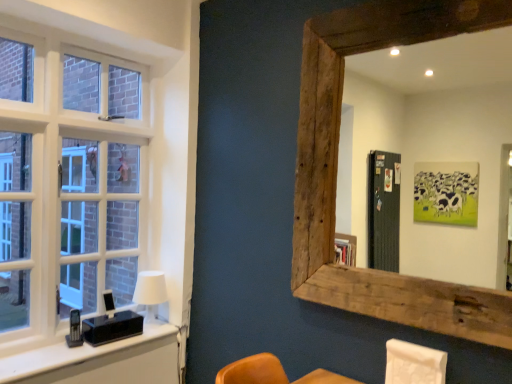
Question: Can you confirm if white matte table lamp at left is positioned to the left of white fabric swivel chair at lower right?

Choices:
 (A) yes
 (B) no

Answer: (A)

Question: From a real-world perspective, is white matte table lamp at left on white fabric swivel chair at lower right?

Choices:
 (A) yes
 (B) no

Answer: (A)

Question: Is white matte table lamp at left shorter than white fabric swivel chair at lower right?

Choices:
 (A) yes
 (B) no

Answer: (B)

Question: Is white matte table lamp at left smaller than white fabric swivel chair at lower right?

Choices:
 (A) no
 (B) yes

Answer: (A)

Question: Is white matte table lamp at left not within white fabric swivel chair at lower right?

Choices:
 (A) no
 (B) yes

Answer: (B)

Question: From the image's perspective, is white matte table lamp at left on white fabric swivel chair at lower right?

Choices:
 (A) yes
 (B) no

Answer: (A)

Question: Considering the relative sizes of rustic wood mirror at upper right and black plastic vanity at left in the image provided, is rustic wood mirror at upper right thinner than black plastic vanity at left?

Choices:
 (A) no
 (B) yes

Answer: (B)

Question: Can you confirm if rustic wood mirror at upper right is taller than black plastic vanity at left?

Choices:
 (A) yes
 (B) no

Answer: (A)

Question: From a real-world perspective, does rustic wood mirror at upper right sit lower than black plastic vanity at left?

Choices:
 (A) no
 (B) yes

Answer: (A)

Question: Does rustic wood mirror at upper right turn towards black plastic vanity at left?

Choices:
 (A) no
 (B) yes

Answer: (A)

Question: Is rustic wood mirror at upper right smaller than black plastic vanity at left?

Choices:
 (A) yes
 (B) no

Answer: (B)

Question: Is the position of rustic wood mirror at upper right more distant than that of black plastic vanity at left?

Choices:
 (A) no
 (B) yes

Answer: (A)

Question: Does white matte table lamp at left appear on the right side of rustic wood mirror at upper right?

Choices:
 (A) yes
 (B) no

Answer: (B)